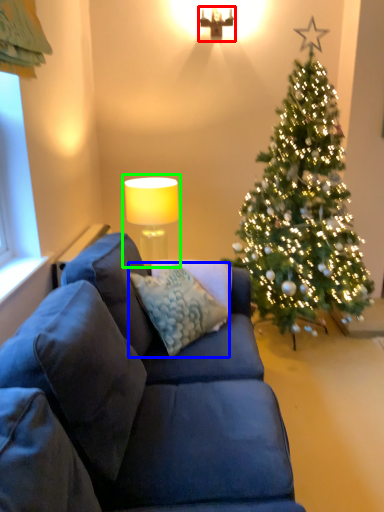
Question: Estimate the real-world distances between objects in this image. Which object is closer to lamp (highlighted by a red box), pillow (highlighted by a blue box) or table lamp (highlighted by a green box)?

Choices:
 (A) pillow
 (B) table lamp

Answer: (B)